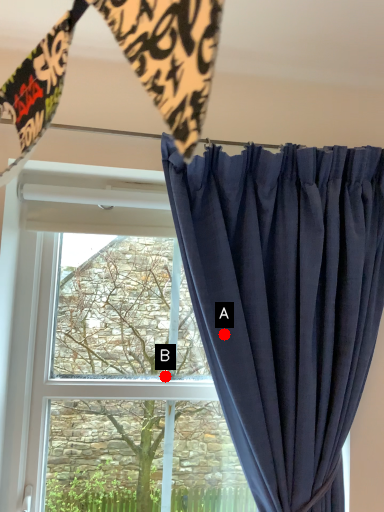
Question: Two points are circled on the image, labeled by A and B beside each circle. Among these points, which one is farthest from the camera?

Choices:
 (A) A is further
 (B) B is further

Answer: (B)